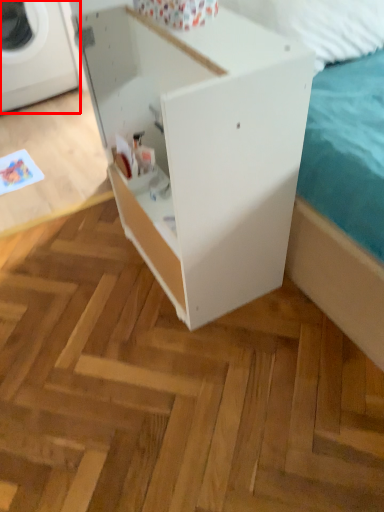
Question: From the image's perspective, where is washing machine (annotated by the red box) located in relation to furniture in the image?

Choices:
 (A) below
 (B) above

Answer: (B)